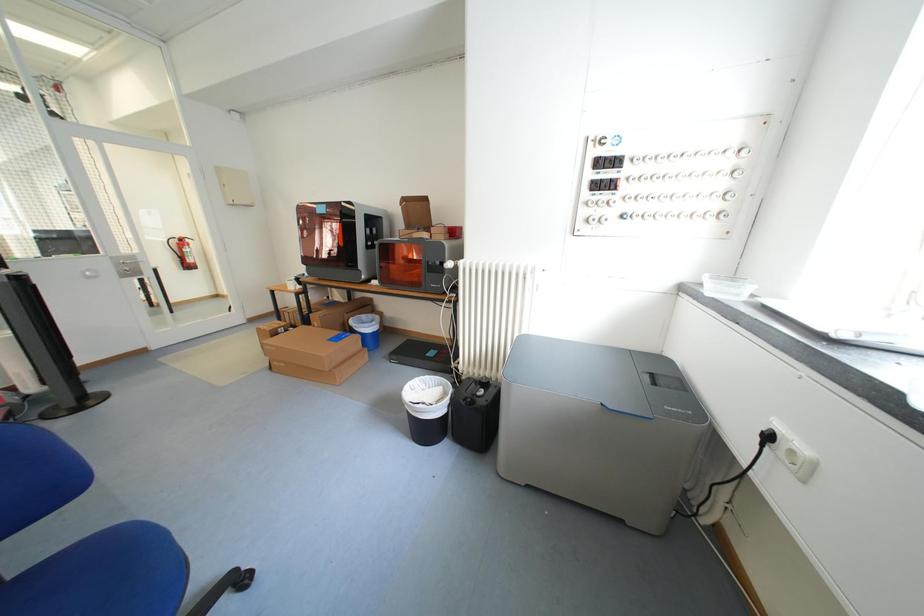
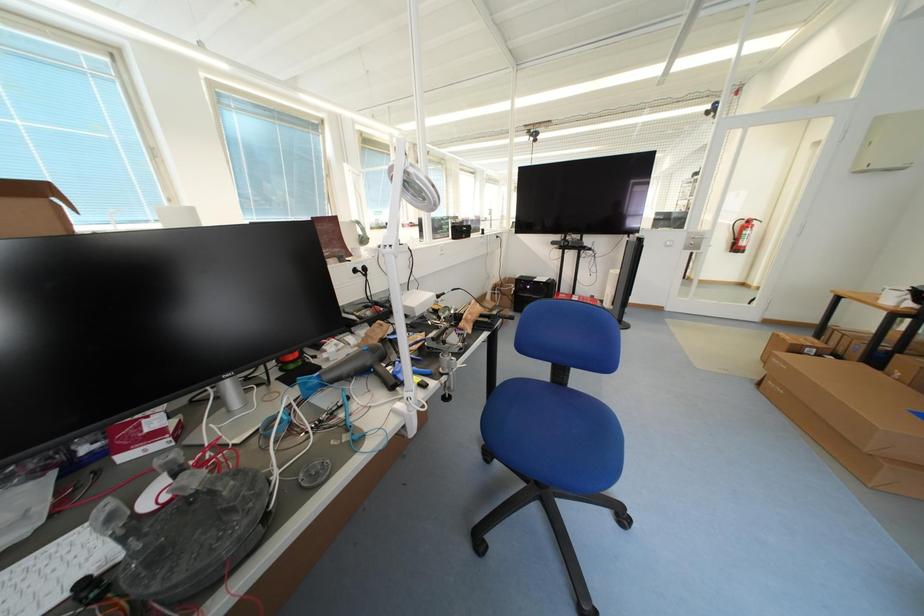
The first image is from the beginning of the video and the second image is from the end. How did the camera likely rotate when shooting the video?

The camera rotated toward left-down.